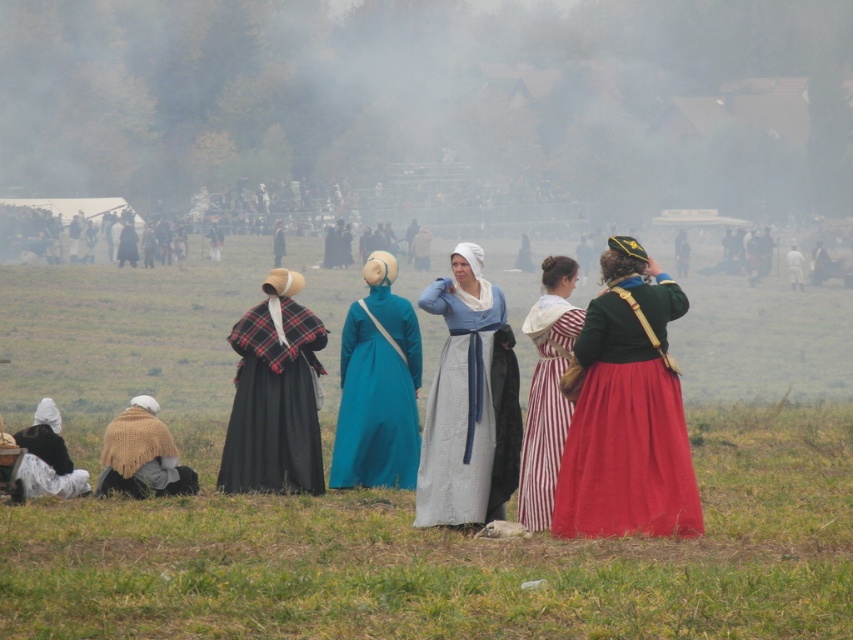
Question: Which object is positioned farthest from the white cotton shirt at center?

Choices:
 (A) velvet green jacket at center
 (B) matte blue fabric dress at center

Answer: (A)

Question: Is black woolen scarf at lower left further to camera compared to white cotton shirt at center?

Choices:
 (A) yes
 (B) no

Answer: (B)

Question: Which object is farther from the camera taking this photo?

Choices:
 (A) plaid wool cape at center-left
 (B) striped cotton dress at center
 (C) matte blue fabric dress at center
 (D) teal fabric dress at center

Answer: (D)

Question: Does plaid wool cape at center-left have a lesser width compared to black woolen dress at center?

Choices:
 (A) no
 (B) yes

Answer: (B)

Question: Can you confirm if black woolen scarf at lower left is wider than white cotton shirt at center?

Choices:
 (A) no
 (B) yes

Answer: (A)

Question: Among these points, which one is farthest from the camera?

Choices:
 (A) (398, 476)
 (B) (785, 259)
 (C) (550, 282)
 (D) (136, 252)

Answer: (B)